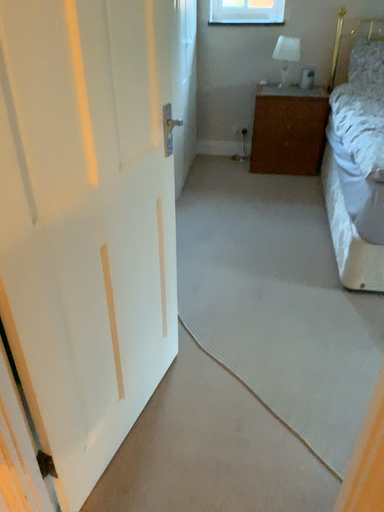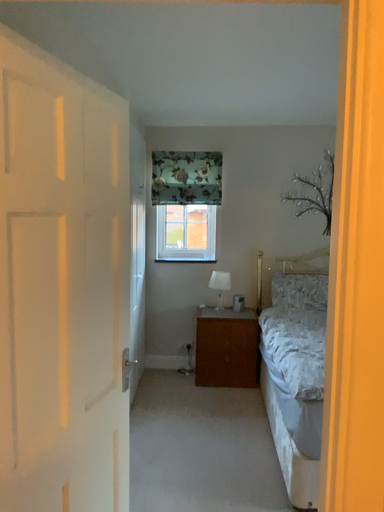
Question: How did the camera likely rotate when shooting the video?

Choices:
 (A) rotated downward
 (B) rotated upward

Answer: (B)